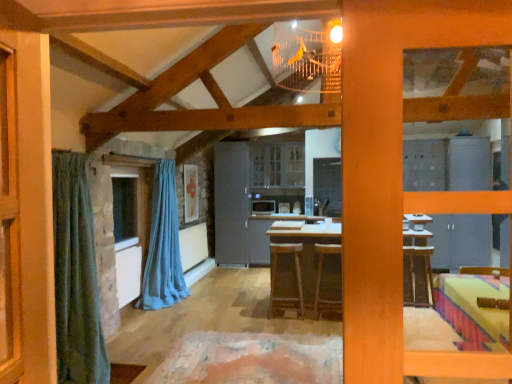
At what (x,y) coordinates should I click in order to perform the action: click on clear glass window at center. Please return your answer as a coordinate pair (x, y). Looking at the image, I should click on (124, 208).

The width and height of the screenshot is (512, 384). I want to click on wooden table at center, so click(x=270, y=234).

Image resolution: width=512 pixels, height=384 pixels. What do you see at coordinates (263, 206) in the screenshot?
I see `satin silver microwave at center` at bounding box center [263, 206].

The image size is (512, 384). Describe the element at coordinates (231, 203) in the screenshot. I see `gray matte refrigerator at center` at that location.

The height and width of the screenshot is (384, 512). In order to click on clear glass window at center in this screenshot , I will do `click(124, 208)`.

From the picture: Which of these two, blue fabric curtain at left or brown wooden stool at center, which is counted as the 1th stool, starting from the right, is thinner?

With smaller width is brown wooden stool at center, which is counted as the 1th stool, starting from the right.

From the picture: Does blue fabric curtain at left have a lesser height compared to brown wooden stool at center, positioned as the 2th stool in left-to-right order?

No.

Is blue fabric curtain at left spatially inside brown wooden stool at center, positioned as the 2th stool in left-to-right order, or outside of it?

blue fabric curtain at left exists outside the volume of brown wooden stool at center, positioned as the 2th stool in left-to-right order.

Is brown wooden stool at center, the 1th stool positioned from the left, in front of blue fabric curtain at left?

Yes.

Can you confirm if brown wooden stool at center, which ranks as the 2th stool in right-to-left order, is bigger than blue fabric curtain at left?

No, brown wooden stool at center, which ranks as the 2th stool in right-to-left order, is not bigger than blue fabric curtain at left.

Is brown wooden stool at center, the 1th stool positioned from the left, looking in the opposite direction of blue fabric curtain at left?

That's not correct — brown wooden stool at center, the 1th stool positioned from the left, is not looking away from blue fabric curtain at left.

Would you say brown wooden stool at center, which ranks as the 2th stool in right-to-left order, contains blue fabric curtain at left?

Definitely not — blue fabric curtain at left is not inside brown wooden stool at center, which ranks as the 2th stool in right-to-left order.

From the image's perspective, is wooden table at center beneath gray matte refrigerator at center?

Yes.

Is wooden table at center taller than gray matte refrigerator at center?

In fact, wooden table at center may be shorter than gray matte refrigerator at center.

Which object is further away from the camera taking this photo, wooden table at center or gray matte refrigerator at center?

gray matte refrigerator at center is behind.

Is wooden table at center situated inside gray matte refrigerator at center or outside?

wooden table at center cannot be found inside gray matte refrigerator at center.

From the picture: Is clear glass window at center oriented towards wooden table at center?

No, clear glass window at center is not turned towards wooden table at center.

Identify the location of window in front of the wooden table at center. The width and height of the screenshot is (512, 384). (124, 208).

From a real-world perspective, relative to wooden table at center, is clear glass window at center vertically above or below?

In terms of real-world spatial position, clear glass window at center is above wooden table at center.

From the image's perspective, which one is positioned higher, clear glass window at center or wooden table at center?

clear glass window at center, from the image's perspective.

From a real-world perspective, is brown wooden stool at center, the 1th stool positioned from the left, above or below brown wooden stool at center, which is counted as the 1th stool, starting from the right?

brown wooden stool at center, the 1th stool positioned from the left, is above brown wooden stool at center, which is counted as the 1th stool, starting from the right.

From the picture: Is brown wooden stool at center, which ranks as the 2th stool in right-to-left order, shorter than brown wooden stool at center, which is counted as the 1th stool, starting from the right?

No, brown wooden stool at center, which ranks as the 2th stool in right-to-left order, is not shorter than brown wooden stool at center, which is counted as the 1th stool, starting from the right.

Is brown wooden stool at center, the 1th stool positioned from the left, far away from brown wooden stool at center, positioned as the 2th stool in left-to-right order?

brown wooden stool at center, the 1th stool positioned from the left, is actually quite close to brown wooden stool at center, positioned as the 2th stool in left-to-right order.

Based on the photo, from the image's perspective, would you say brown wooden stool at center, which ranks as the 2th stool in right-to-left order, is positioned over brown wooden stool at center, positioned as the 2th stool in left-to-right order?

No, from the image's perspective, brown wooden stool at center, which ranks as the 2th stool in right-to-left order, is not on top of brown wooden stool at center, positioned as the 2th stool in left-to-right order.

Can you tell me how much wooden table at center and brown wooden stool at center, the 1th stool positioned from the left, differ in facing direction?

The angular difference between wooden table at center and brown wooden stool at center, the 1th stool positioned from the left, is 179 degrees.

In the image, is wooden table at center on the left side or the right side of brown wooden stool at center, the 1th stool positioned from the left?

From the image, it's evident that wooden table at center is to the right of brown wooden stool at center, the 1th stool positioned from the left.

Where is `table behind the brown wooden stool at center, which ranks as the 2th stool in right-to-left order`? This screenshot has width=512, height=384. table behind the brown wooden stool at center, which ranks as the 2th stool in right-to-left order is located at coordinates (270, 234).

Is wooden table at center oriented towards brown wooden stool at center, the 1th stool positioned from the left?

Yes, wooden table at center faces towards brown wooden stool at center, the 1th stool positioned from the left.

Considering the positions of points (297, 266) and (264, 255), is point (297, 266) closer to camera compared to point (264, 255)?

That is True.

Is brown wooden stool at center, the 1th stool positioned from the left, looking in the opposite direction of wooden table at center?

No.

How different are the orientations of brown wooden stool at center, the 1th stool positioned from the left, and wooden table at center in degrees?

brown wooden stool at center, the 1th stool positioned from the left, and wooden table at center are facing 179 degrees away from each other.

Is brown wooden stool at center, the 1th stool positioned from the left, with wooden table at center?

No, brown wooden stool at center, the 1th stool positioned from the left, is not next to wooden table at center.

In order to click on stool that is the 2nd object to the right of the blue fabric curtain at left, starting at the anchor in this screenshot , I will do `click(321, 276)`.

Identify the location of curtain behind the brown wooden stool at center, which ranks as the 2th stool in right-to-left order. (163, 245).

Considering their positions, is brown wooden stool at center, which is counted as the 1th stool, starting from the right, positioned further to wooden table at center than clear glass window at center?

clear glass window at center.

When comparing their distances from blue fabric curtain at left, does gray matte refrigerator at center or wooden table at center seem closer?

gray matte refrigerator at center is positioned closer to the anchor blue fabric curtain at left.

Based on their spatial positions, is brown wooden stool at center, the 1th stool positioned from the left, or satin silver microwave at center closer to wooden table at center?

The object closer to wooden table at center is satin silver microwave at center.

Considering their positions, is satin silver microwave at center positioned further to brown wooden stool at center, which is counted as the 1th stool, starting from the right, than gray matte refrigerator at center?

gray matte refrigerator at center is positioned further to the anchor brown wooden stool at center, which is counted as the 1th stool, starting from the right.

Based on their spatial positions, is wooden table at center or satin silver microwave at center further from gray matte refrigerator at center?

satin silver microwave at center is further to gray matte refrigerator at center.

When comparing their distances from gray matte refrigerator at center, does wooden table at center or brown wooden stool at center, the 1th stool positioned from the left, seem closer?

wooden table at center is closer to gray matte refrigerator at center.

Looking at this image, which object lies nearer to the anchor point brown wooden stool at center, which is counted as the 1th stool, starting from the right, clear glass window at center or satin silver microwave at center?

clear glass window at center is positioned closer to the anchor brown wooden stool at center, which is counted as the 1th stool, starting from the right.

Looking at the image, which one is located closer to brown wooden stool at center, positioned as the 2th stool in left-to-right order, brown wooden stool at center, which ranks as the 2th stool in right-to-left order, or gray matte refrigerator at center?

brown wooden stool at center, which ranks as the 2th stool in right-to-left order, is closer to brown wooden stool at center, positioned as the 2th stool in left-to-right order.

In order to click on table between blue fabric curtain at left and gray matte refrigerator at center in the front-back direction in this screenshot , I will do `click(270, 234)`.

Locate an element on the screen. The width and height of the screenshot is (512, 384). curtain located between brown wooden stool at center, which is counted as the 1th stool, starting from the right, and gray matte refrigerator at center in the depth direction is located at coordinates (163, 245).

Locate an element on the screen. This screenshot has height=384, width=512. curtain between brown wooden stool at center, the 1th stool positioned from the left, and wooden table at center in the front-back direction is located at coordinates (163, 245).

Locate an element on the screen. The width and height of the screenshot is (512, 384). appliance between gray matte refrigerator at center and wooden table at center from left to right is located at coordinates (263, 206).